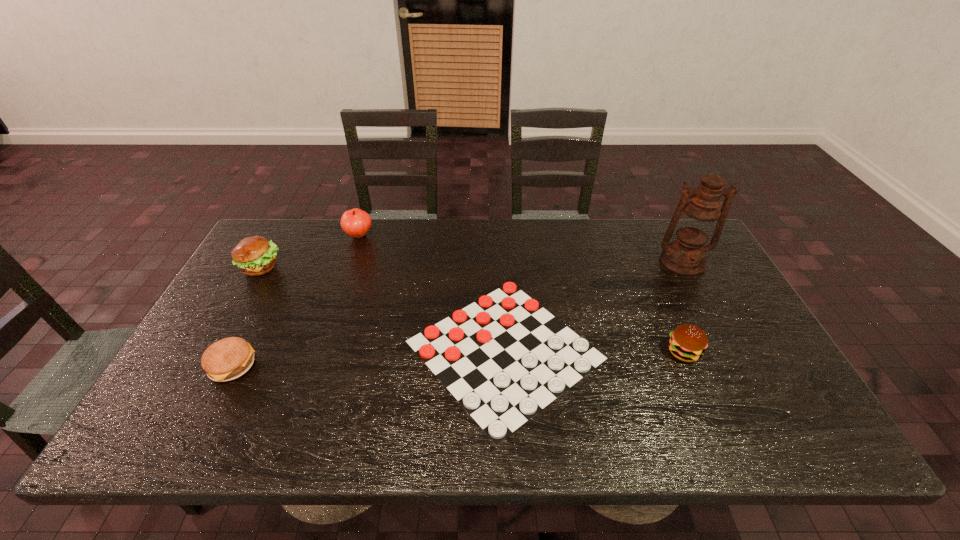
Find the location of a particular element. Image resolution: width=960 pixels, height=540 pixels. the tallest object is located at coordinates (696, 220).

Locate an element on the screen. apple is located at coordinates (355, 222).

The image size is (960, 540). Identify the location of the fourth object from right to left. (355, 222).

Where is `the tallest hamburger`? the tallest hamburger is located at coordinates (255, 255).

This screenshot has height=540, width=960. I want to click on the fourth tallest object, so click(687, 342).

Where is `the second shortest hamburger`? the second shortest hamburger is located at coordinates (687, 342).

Find the location of a particular element. This screenshot has height=540, width=960. the shortest hamburger is located at coordinates (227, 359).

I want to click on the shortest object, so [x=504, y=357].

The image size is (960, 540). Identify the location of the fourth object from left to right. (504, 357).

You are a GUI agent. You are given a task and a screenshot of the screen. Output one action in this format:
    pyautogui.click(x=<x>, y=<y>)
    Task: Click on the free space located 0.110m on the back of the oil lamp
    The image size is (960, 540).
    Given the screenshot: What is the action you would take?
    pyautogui.click(x=664, y=228)